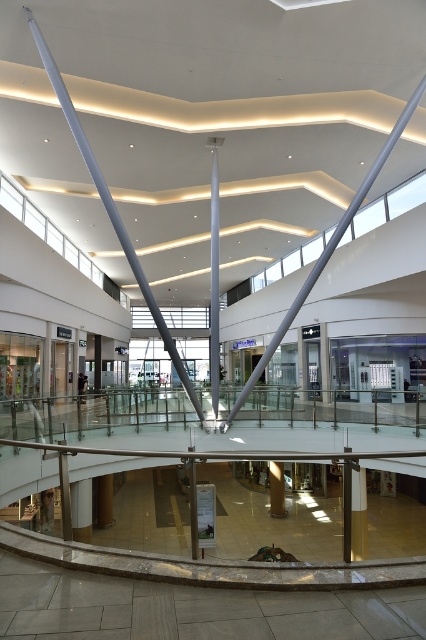
Question: Which object appears farthest from the camera in this image?

Choices:
 (A) matte silver beam at center
 (B) smooth white pillar at center

Answer: (B)

Question: Which of the following is the farthest from the observer?

Choices:
 (A) silver metallic beam at center
 (B) polished silver beam at center

Answer: (B)

Question: Which point is farther to the camera?

Choices:
 (A) (281, 481)
 (B) (215, 188)

Answer: (A)

Question: Can you confirm if silver metallic beam at center is positioned below polished silver beam at center?

Choices:
 (A) yes
 (B) no

Answer: (B)

Question: Can you confirm if silver metallic beam at center is wider than matte silver beam at center?

Choices:
 (A) yes
 (B) no

Answer: (A)

Question: Is silver metallic beam at center behind gold polished pillar at center?

Choices:
 (A) yes
 (B) no

Answer: (B)